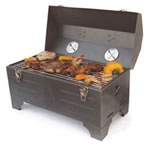
At what (x,y) coordinates should I click in order to perform the action: click on front left table leg. Please return your answer as a coordinate pair (x, y). The height and width of the screenshot is (147, 150). Looking at the image, I should click on (15, 105).